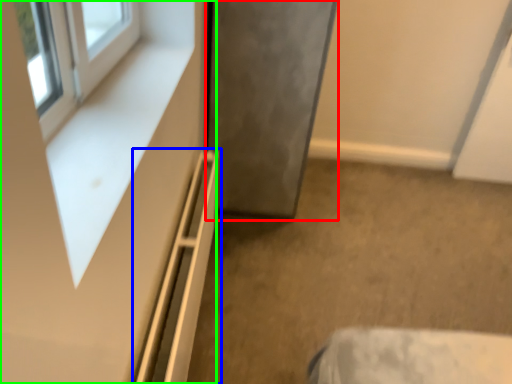
Question: Estimate the real-world distances between objects in this image. Which object is closer to door (highlighted by a red box), shelf (highlighted by a blue box) or dresser (highlighted by a green box)?

Choices:
 (A) shelf
 (B) dresser

Answer: (A)